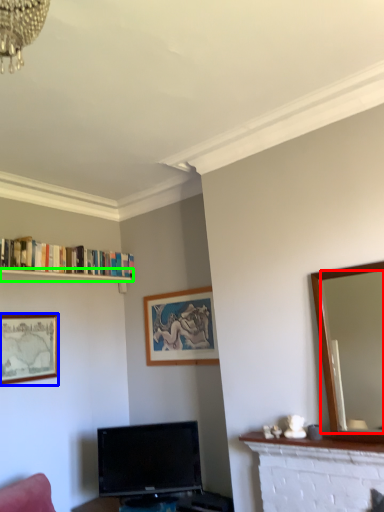
Question: Estimate the real-world distances between objects in this image. Which object is closer to mirror (highlighted by a red box), picture frame (highlighted by a blue box) or shelf (highlighted by a green box)?

Choices:
 (A) picture frame
 (B) shelf

Answer: (A)